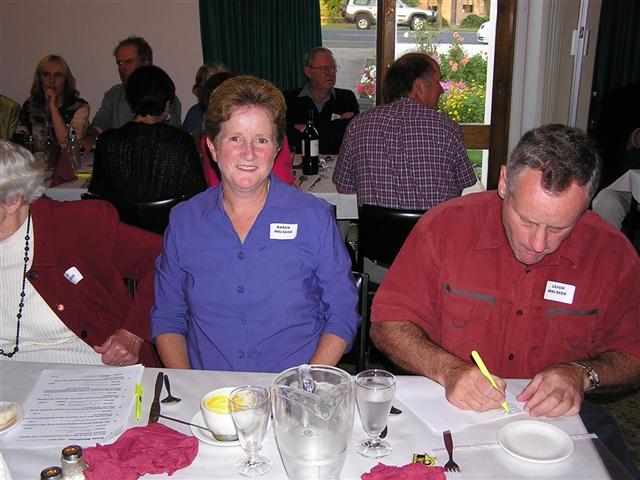
This screenshot has height=480, width=640. I want to click on pitcher, so click(x=292, y=440).